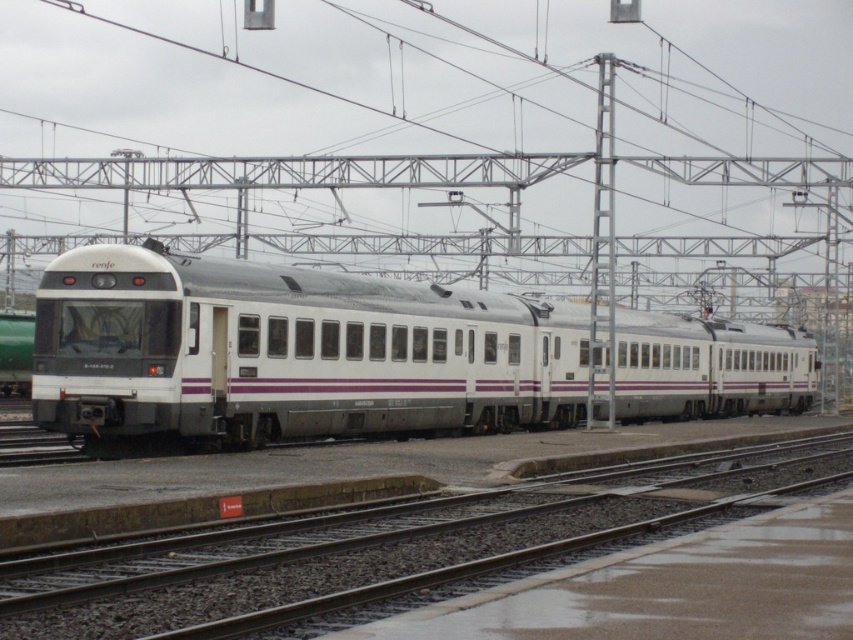
Question: Does white glossy train at center appear under metal track at center?

Choices:
 (A) yes
 (B) no

Answer: (B)

Question: Which point is closer to the camera?

Choices:
 (A) white glossy train at center
 (B) metal track at center

Answer: (B)

Question: Can you confirm if white glossy train at center is positioned below metal track at center?

Choices:
 (A) yes
 (B) no

Answer: (B)

Question: Where is white glossy train at center located in relation to metal track at center in the image?

Choices:
 (A) above
 (B) below

Answer: (A)